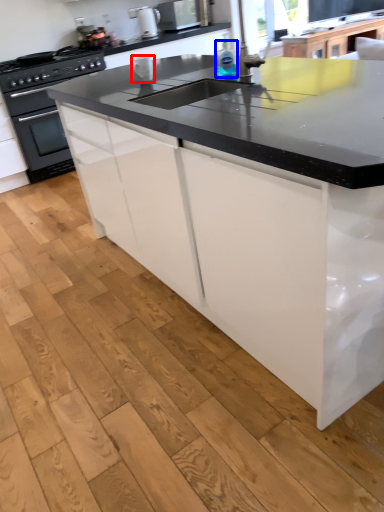
Question: Which point is further to the camera, appliance (highlighted by a red box) or bottle (highlighted by a blue box)?

Choices:
 (A) appliance
 (B) bottle

Answer: (A)